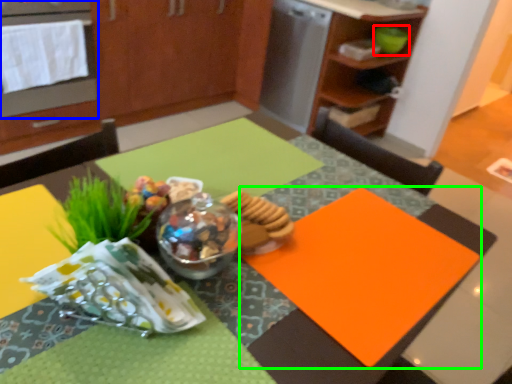
Question: Which is nearer to the teal (highlighted by a red box)? oven (highlighted by a blue box) or place mat (highlighted by a green box).

Choices:
 (A) oven
 (B) place mat

Answer: (A)